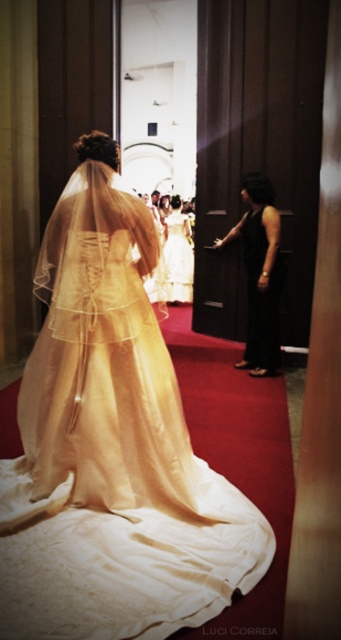
You are a photographer positioned at the back of the aisle during a wedding. You need to capture a photo of both the ivory satin gown at center and the black satin dress at right. Which gown should you focus on first to ensure both are in frame?

The ivory satin gown at center is in front of the black satin dress at right, so you should focus on the ivory satin gown at center first to ensure both are in frame.

You are a photographer at the wedding ceremony. You need to capture a photo of the white satin dress at center and the black satin dress at right. Based on their positions, which dress is positioned lower in the frame?

The black satin dress at right is positioned lower in the frame than the white satin dress at center.

You are a photographer positioned at the entrance of the venue. You need to capture a photo of the ivory satin gown at center. Based on its position, which direction should you move to frame it properly?

The ivory satin gown at center is located at point (111, 445), so you should move to your right to frame it properly.